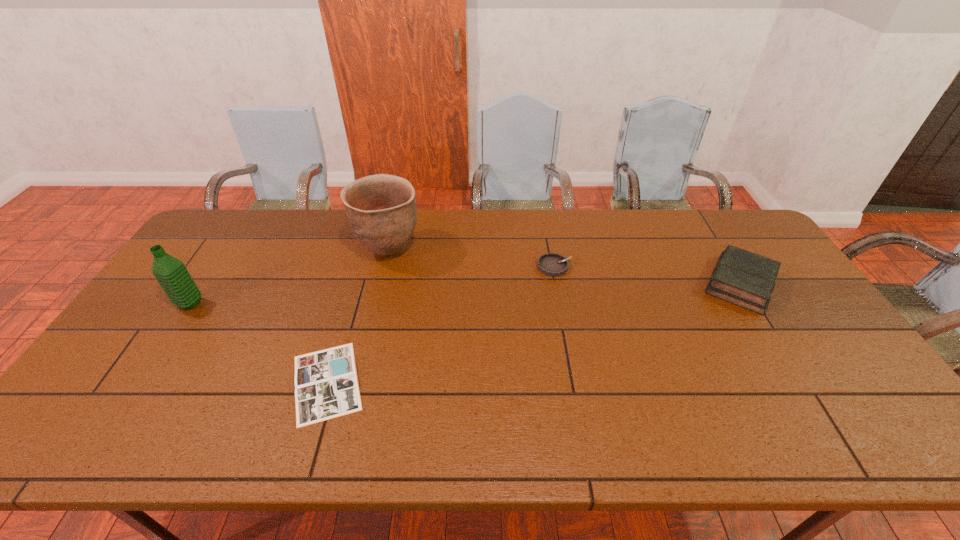
Locate an element on the screen. The image size is (960, 540). object that stands as the third closest to the second object from right to left is located at coordinates (326, 384).

Image resolution: width=960 pixels, height=540 pixels. I want to click on free space that satisfies the following two spatial constraints: 1. on the back side of the farther book; 2. on the left side of the leftmost object, so click(x=204, y=284).